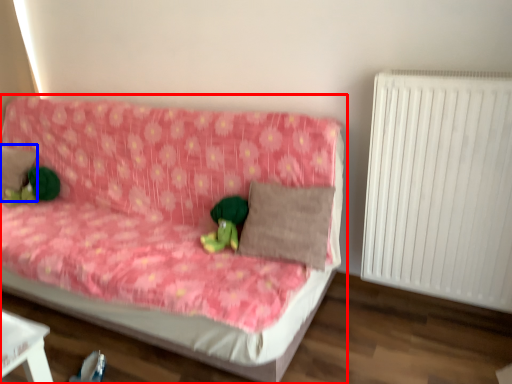
Question: Which object is further to the camera taking this photo, studio couch (highlighted by a red box) or pillow (highlighted by a blue box)?

Choices:
 (A) studio couch
 (B) pillow

Answer: (B)